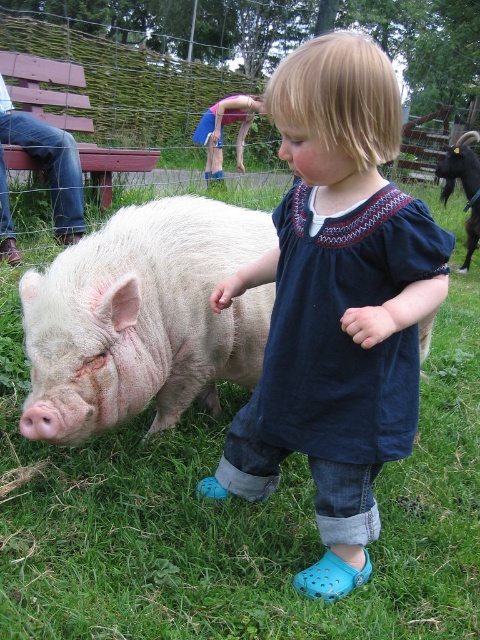
You are a photographer trying to capture the child and the pig in the scene. Since the green grass at center and blue denim shorts at center are both in the foreground, which one should you focus on to ensure the subject with the wider base is properly framed?

The green grass at center is wider than the blue denim shorts at center, so focusing on the green grass at center will ensure the wider subject is properly framed.